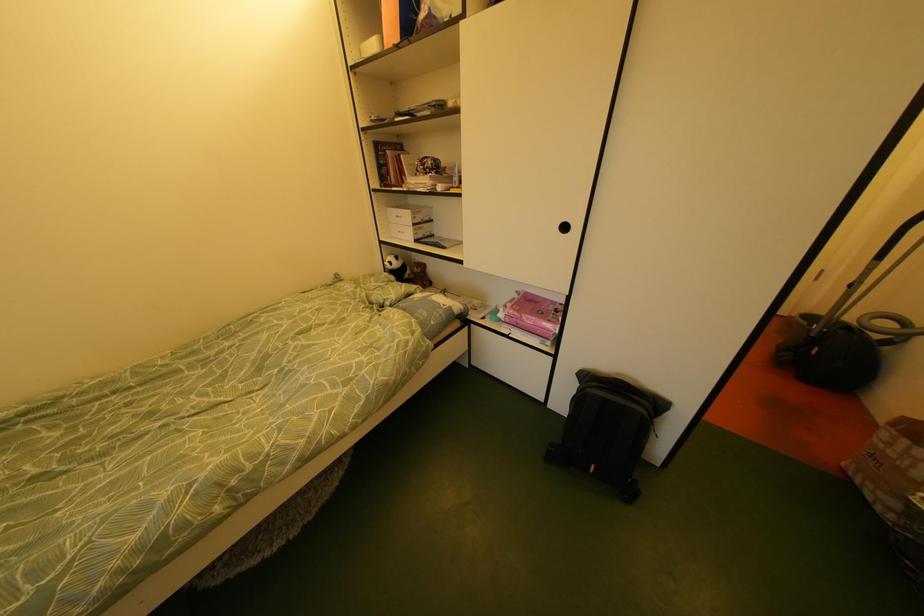
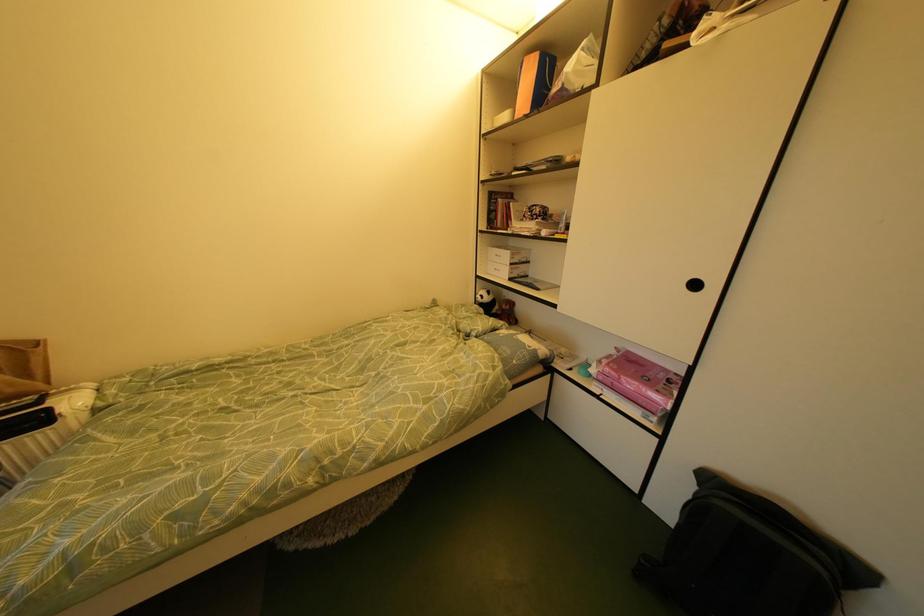
Question: The camera is either moving clockwise (left) or counter-clockwise (right) around the object. The first image is from the beginning of the video and the second image is from the end. Is the camera moving left or right when shooting the video?

Choices:
 (A) Left
 (B) Right

Answer: (B)